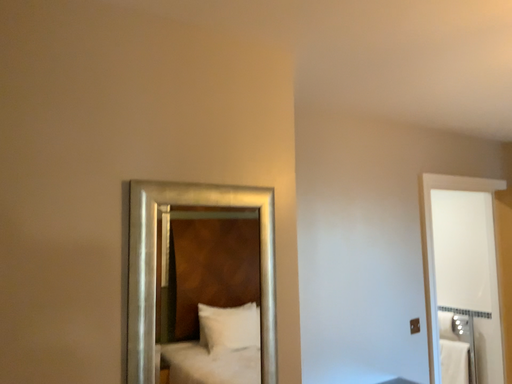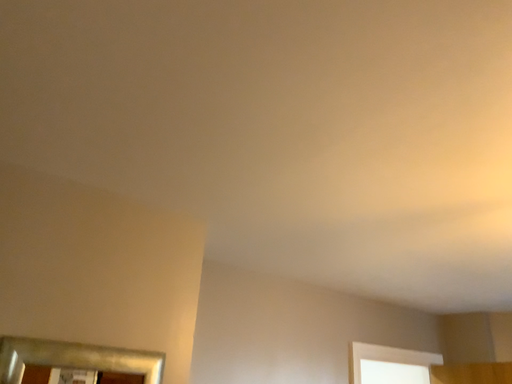
Question: How did the camera likely rotate when shooting the video?

Choices:
 (A) rotated upward
 (B) rotated downward

Answer: (A)